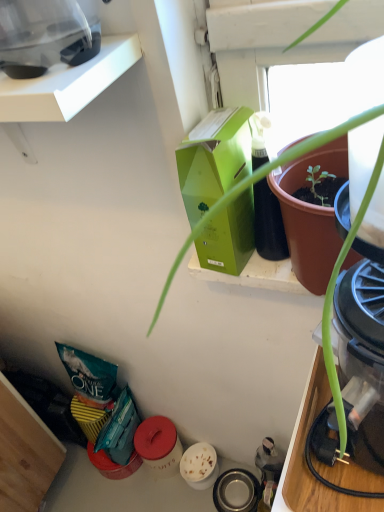
Question: Considering the relative sizes of transparent plastic blender at upper left, the first appliance from the top, and green matte box at upper center in the image provided, is transparent plastic blender at upper left, the first appliance from the top, smaller than green matte box at upper center?

Choices:
 (A) no
 (B) yes

Answer: (A)

Question: Can you confirm if transparent plastic blender at upper left, which ranks as the second appliance in back-to-front order, is taller than green matte box at upper center?

Choices:
 (A) yes
 (B) no

Answer: (A)

Question: Considering the relative positions of transparent plastic blender at upper left, the second appliance in the bottom-to-top sequence, and green matte box at upper center in the image provided, is transparent plastic blender at upper left, the second appliance in the bottom-to-top sequence, to the left of green matte box at upper center from the viewer's perspective?

Choices:
 (A) no
 (B) yes

Answer: (B)

Question: Does transparent plastic blender at upper left, the second appliance in the bottom-to-top sequence, come in front of green matte box at upper center?

Choices:
 (A) no
 (B) yes

Answer: (B)

Question: Can you confirm if transparent plastic blender at upper left, placed as the 1th appliance when sorted from left to right, is positioned to the right of green matte box at upper center?

Choices:
 (A) no
 (B) yes

Answer: (A)

Question: Can we say transparent plastic blender at upper left, which is the first appliance from front to back, lies outside green matte box at upper center?

Choices:
 (A) no
 (B) yes

Answer: (B)

Question: Is metallic stainless steel bowl at lower center, arranged as the first appliance when viewed from the right, wider than green matte box at upper center?

Choices:
 (A) yes
 (B) no

Answer: (A)

Question: From a real-world perspective, is metallic stainless steel bowl at lower center, the second appliance from the top, physically below green matte box at upper center?

Choices:
 (A) no
 (B) yes

Answer: (B)

Question: Considering the relative positions of metallic stainless steel bowl at lower center, arranged as the first appliance when viewed from the right, and green matte box at upper center in the image provided, is metallic stainless steel bowl at lower center, arranged as the first appliance when viewed from the right, behind green matte box at upper center?

Choices:
 (A) no
 (B) yes

Answer: (B)

Question: Does metallic stainless steel bowl at lower center, placed as the first appliance when sorted from bottom to top, have a lesser width compared to green matte box at upper center?

Choices:
 (A) yes
 (B) no

Answer: (B)

Question: Is metallic stainless steel bowl at lower center, the 2th appliance positioned from the left, next to green matte box at upper center?

Choices:
 (A) yes
 (B) no

Answer: (B)

Question: Are metallic stainless steel bowl at lower center, placed as the first appliance when sorted from bottom to top, and green matte box at upper center far apart?

Choices:
 (A) yes
 (B) no

Answer: (B)

Question: Could you tell me if transparent plastic blender at upper left, which is counted as the 2th appliance, starting from the right, is facing metallic stainless steel bowl at lower center, which is the second appliance in front-to-back order?

Choices:
 (A) no
 (B) yes

Answer: (A)